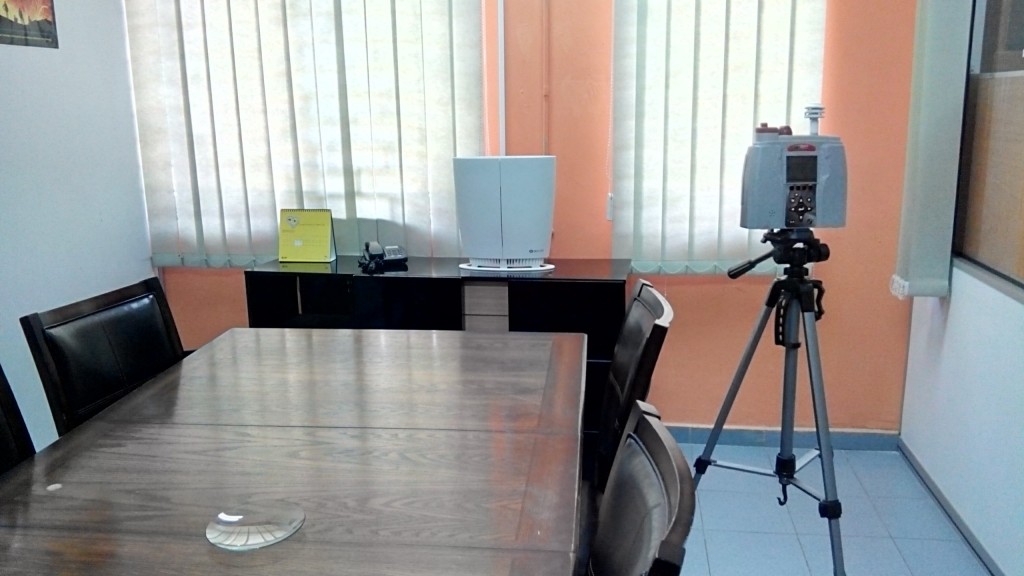
You are a GUI agent. You are given a task and a screenshot of the screen. Output one action in this format:
    pyautogui.click(x=<x>, y=<y>)
    Task: Click on the monitor on credenza
    
    Given the screenshot: What is the action you would take?
    pyautogui.click(x=512, y=202)